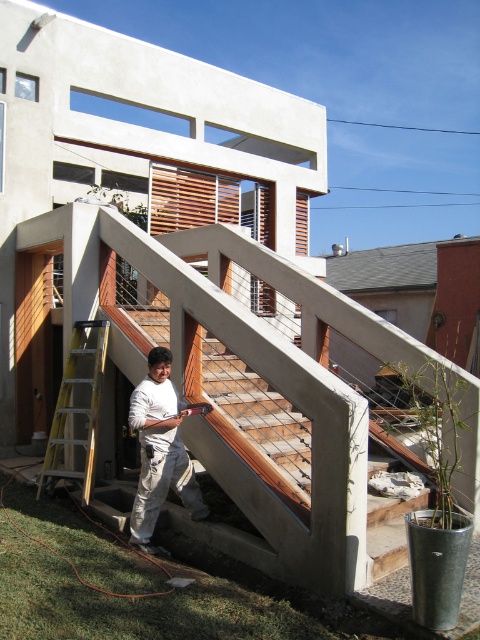
You are a tailor measuring the distance between two points in a photo. You need to determine if a 30 inch long tape measure can fully span the gap between the wooden at center and the white matte shirt at center. Can it?

The distance between the wooden at center and the white matte shirt at center is 29.83 inches, so a 30 inch long tape measure can fully span the gap between them since it is slightly longer than the distance.